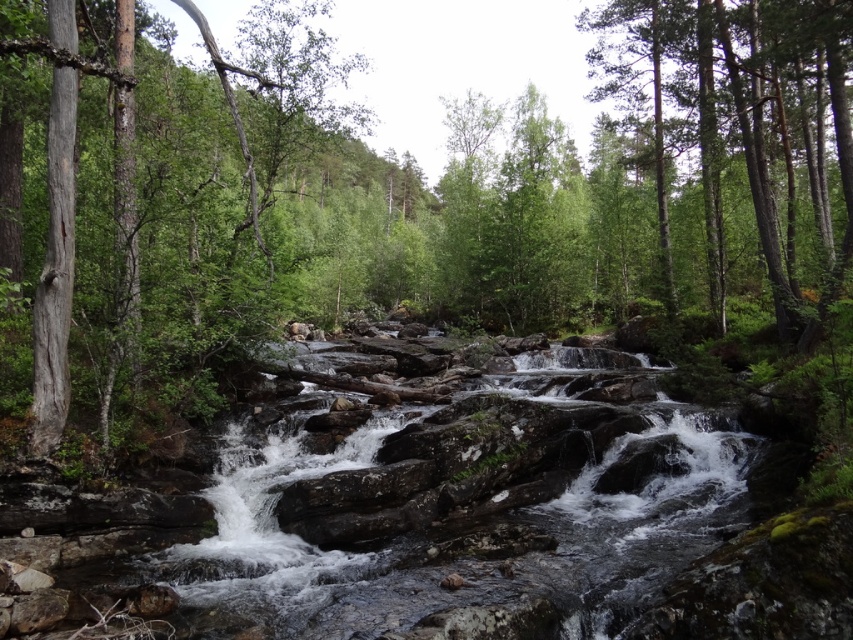
Is green leafy forest at center to the right of green smooth tree at upper right from the viewer's perspective?

No, green leafy forest at center is not to the right of green smooth tree at upper right.

Does green leafy forest at center have a larger size compared to green smooth tree at upper right?

No, green leafy forest at center is not bigger than green smooth tree at upper right.

Find the location of a particular element. The height and width of the screenshot is (640, 853). green leafy forest at center is located at coordinates pos(448,192).

At what (x,y) coordinates should I click in order to perform the action: click on green leafy forest at center. Please return your answer as a coordinate pair (x, y). The image size is (853, 640). Looking at the image, I should click on (448, 192).

In the scene shown: Is green leafy forest at center smaller than smooth bark tree at left?

No, green leafy forest at center is not smaller than smooth bark tree at left.

Does green leafy forest at center come behind smooth bark tree at left?

No, green leafy forest at center is closer to the viewer.

Image resolution: width=853 pixels, height=640 pixels. What are the coordinates of `green leafy forest at center` in the screenshot? It's located at (448, 192).

Between smooth bark tree at left and green smooth tree at upper right, which one is positioned lower?

smooth bark tree at left

Where is `smooth bark tree at left`? The image size is (853, 640). smooth bark tree at left is located at coordinates (178, 205).